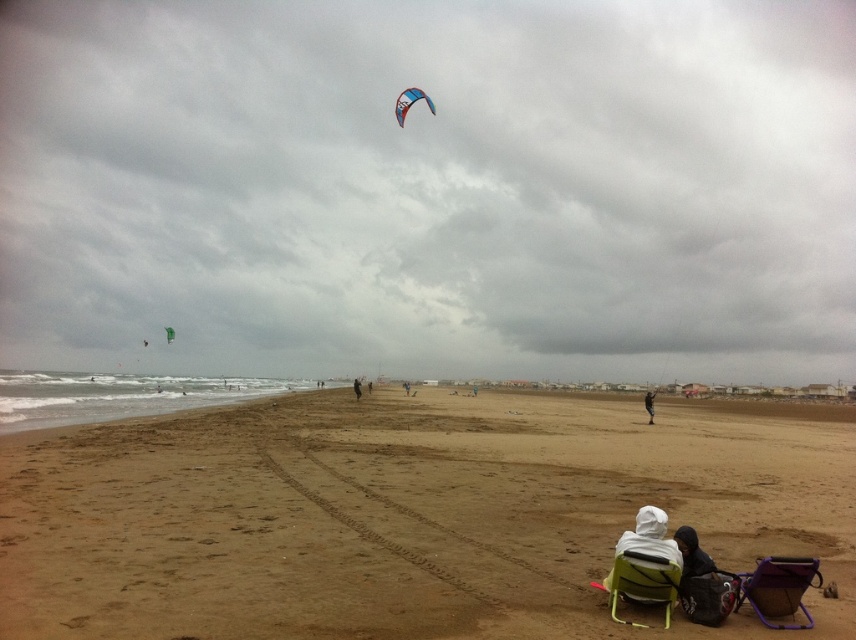
Is purple fabric beach chair at lower right positioned before white fleece jacket at lower right?

Yes, it is.

Who is more forward, (807,564) or (676,554)?

Positioned in front is point (807,564).

What are the coordinates of `purple fabric beach chair at lower right` in the screenshot? It's located at (777, 588).

Can you confirm if white fabric kite at center is bigger than green fabric kite at upper center?

Actually, white fabric kite at center might be smaller than green fabric kite at upper center.

Does white fabric kite at center appear on the right side of green fabric kite at upper center?

Correct, you'll find white fabric kite at center to the right of green fabric kite at upper center.

Where is `white fabric kite at center`? The image size is (856, 640). white fabric kite at center is located at coordinates (357, 387).

This screenshot has height=640, width=856. I want to click on white fabric kite at center, so click(x=357, y=387).

Does cloudy sky at upper center appear under white fabric at lower right?

No.

In the scene shown: Can you confirm if cloudy sky at upper center is positioned above white fabric at lower right?

Yes.

Which is behind, point (522, 64) or point (651, 400)?

The point (522, 64) is behind.

I want to click on cloudy sky at upper center, so click(431, 188).